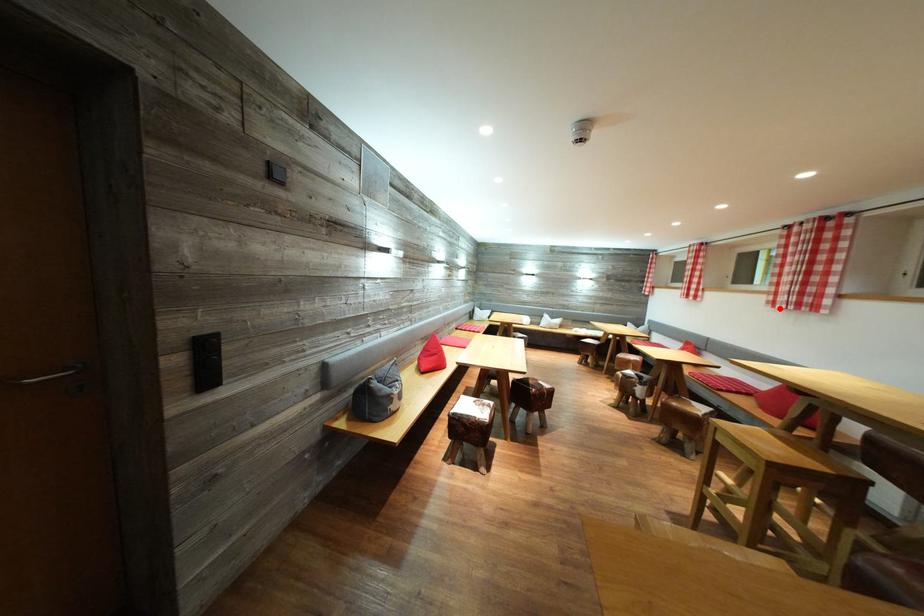
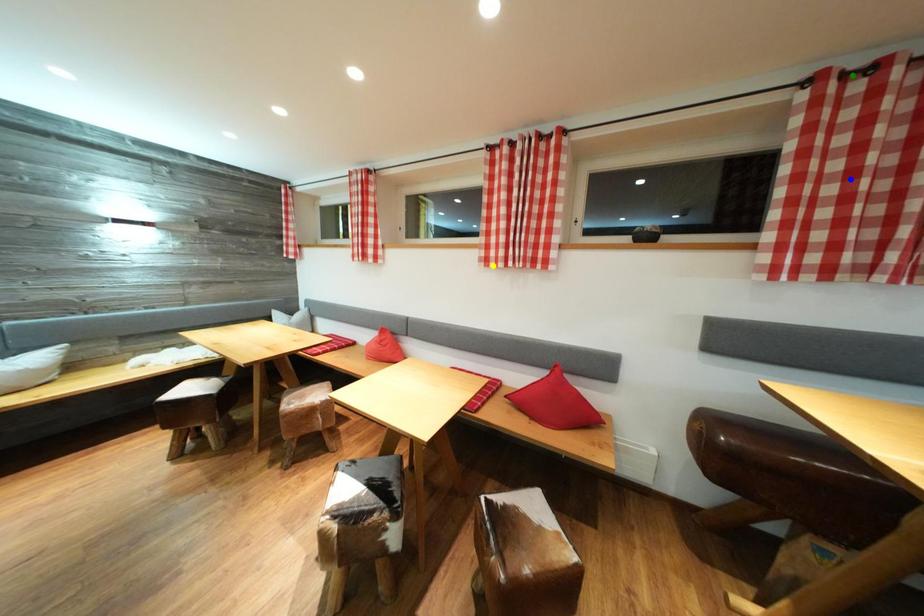
Question: I am providing you with two images of the same scene from different viewpoints. A red point is marked on the first image. You are given multiple points on the second image. Which point in image 2 is actually the same real-world point as the red point in image 1?

Choices:
 (A) blue point
 (B) green point
 (C) yellow point

Answer: (C)